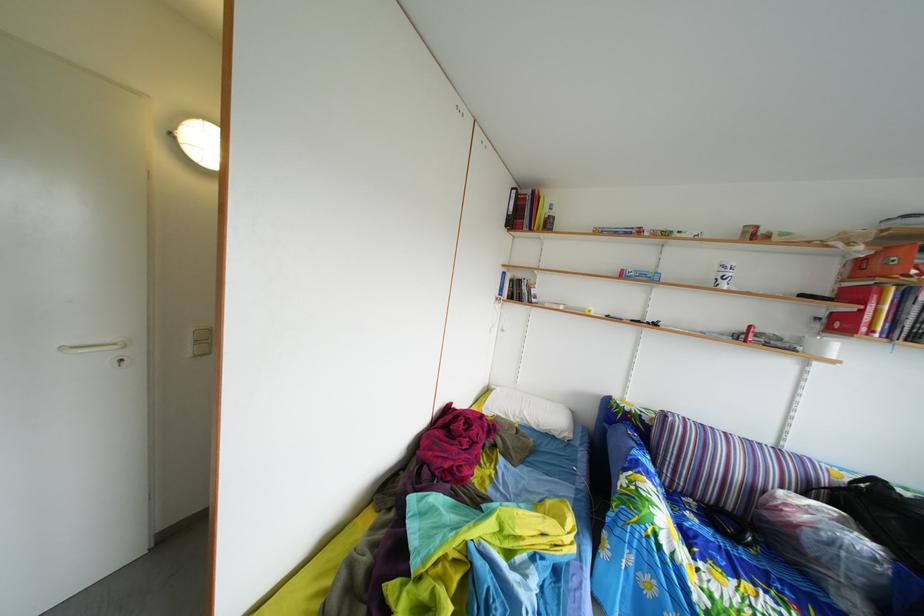
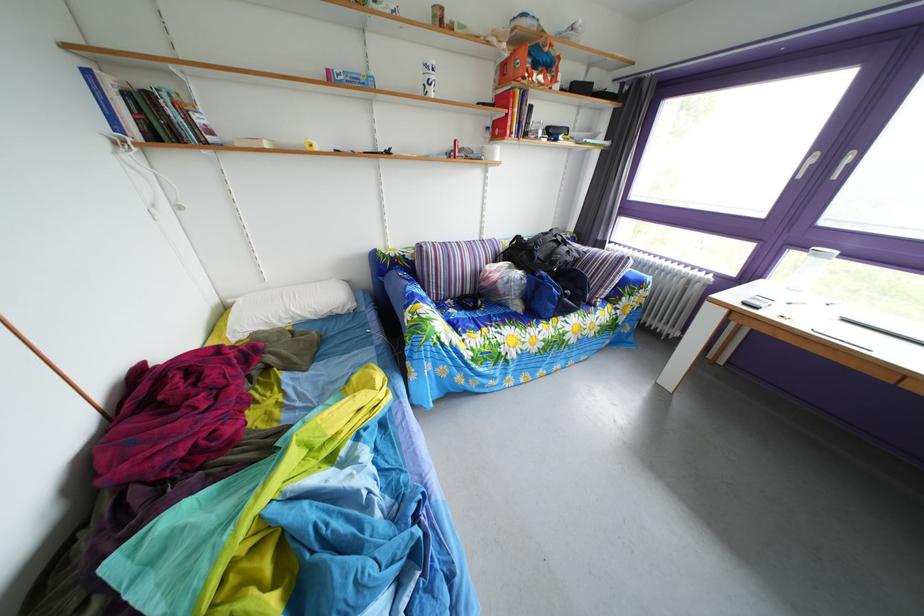
In the second image, find the point that corresponds to pixel 727 276 in the first image.

(432, 79)